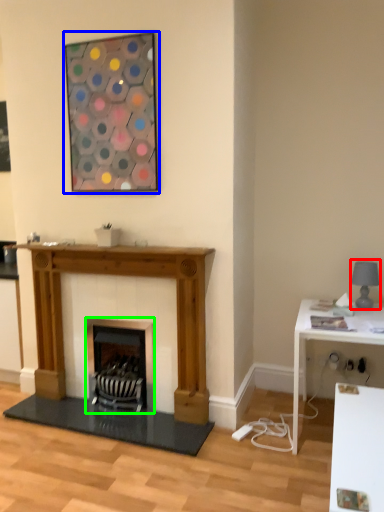
Question: Which object is the closest to the lamp (highlighted by a red box)? Choose among these: picture frame (highlighted by a blue box) or wood burning stove (highlighted by a green box).

Choices:
 (A) picture frame
 (B) wood burning stove

Answer: (B)